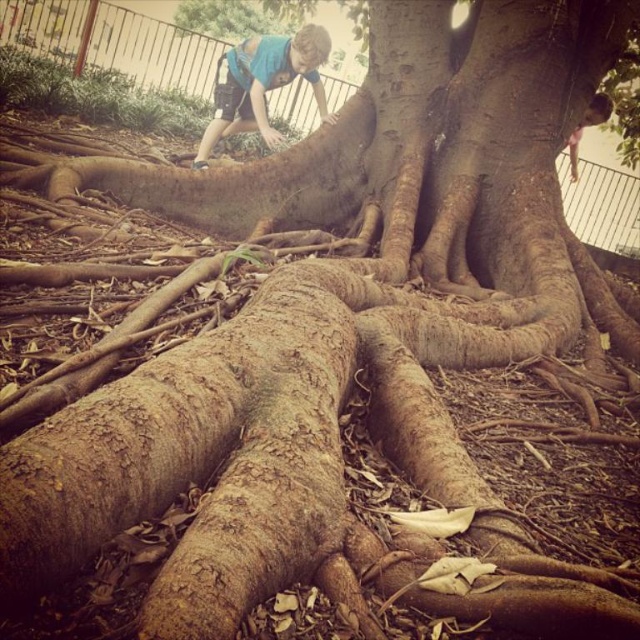
You are a photographer trying to capture a candid shot of the person in the blue cotton shirt at upper center and the person with brown textured hair at upper right. The camera you have can only focus on subjects within a 5 feet range. Can you fit both subjects in the same frame without moving the camera?

The blue cotton shirt at upper center and brown textured hair at upper right are 8.98 feet apart, which exceeds the camera focus range of 5 feet. Therefore, you cannot fit both subjects in the same frame without moving the camera.

From the picture: You are standing in a park and see a person wearing a blue cotton shirt at upper center and brown textured hair at upper right. Which part of the person is closer to your left side?

The blue cotton shirt at upper center is to the left of the brown textured hair at upper right, so the blue cotton shirt at upper center is closer to your left side.